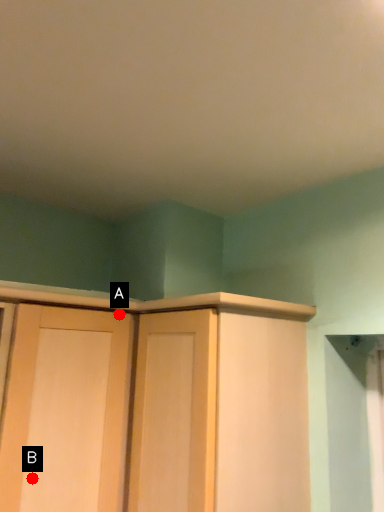
Question: Two points are circled on the image, labeled by A and B beside each circle. Among these points, which one is farthest from the camera?

Choices:
 (A) A is further
 (B) B is further

Answer: (A)